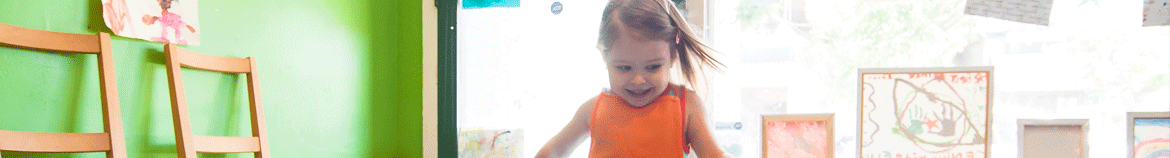
Identify the location of chairs. This screenshot has width=1170, height=158. (194, 55), (84, 44).